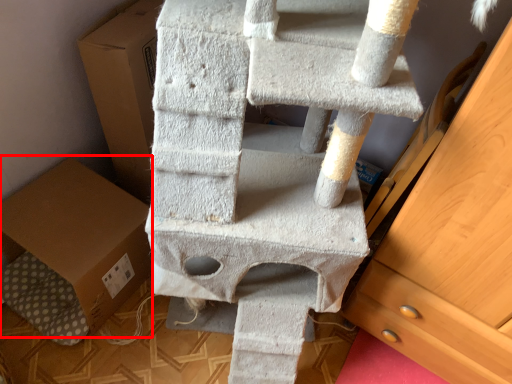
Question: From the image's perspective, what is the correct spatial positioning of cardboard box (annotated by the red box) in reference to chest of drawers?

Choices:
 (A) below
 (B) above

Answer: (A)